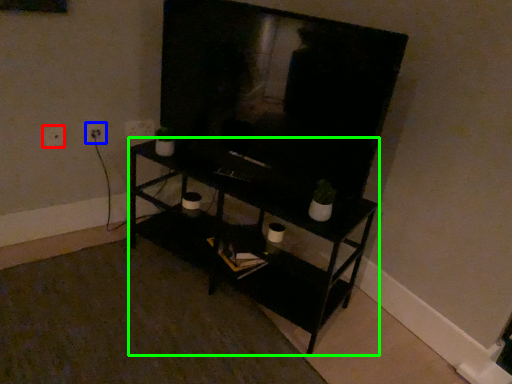
Question: Which object is positioned closest to electric outlet (highlighted by a red box)? Select from electric outlet (highlighted by a blue box) and shelf (highlighted by a green box).

Choices:
 (A) electric outlet
 (B) shelf

Answer: (A)